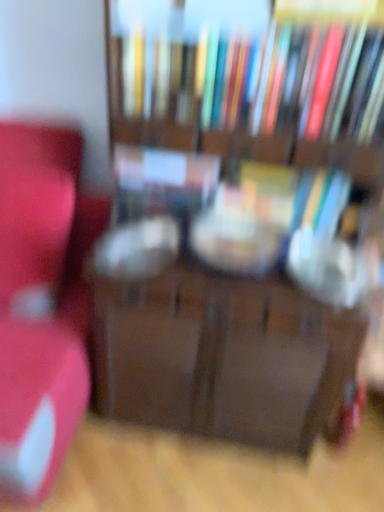
Question: Is matte red chair at left wider or thinner than matte plastic book at center, which is the second book in top-to-bottom order?

Choices:
 (A) wide
 (B) thin

Answer: (A)

Question: Would you say matte red chair at left is inside or outside matte plastic book at center, which is the second book in top-to-bottom order?

Choices:
 (A) inside
 (B) outside

Answer: (B)

Question: Which is farther from the hardcover books at upper center, the 3th book from the bottom?

Choices:
 (A) hardcover book at center, which is the third book from top to bottom
 (B) matte red chair at left
 (C) matte plastic book at center, which is the second book in top-to-bottom order
 (D) wooden bookcase at center

Answer: (B)

Question: Which object is the farthest from the hardcover books at upper center, the 3th book from the bottom?

Choices:
 (A) wooden bookcase at center
 (B) hardcover book at center, which is the third book from top to bottom
 (C) matte plastic book at center, which is the second book in top-to-bottom order
 (D) matte red chair at left

Answer: (D)